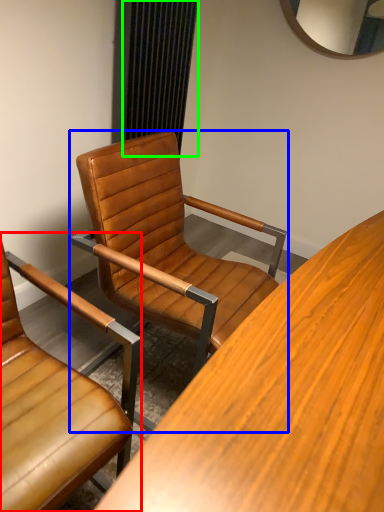
Question: Estimate the real-world distances between objects in this image. Which object is farther from chair (highlighted by a red box), chair (highlighted by a blue box) or curtain (highlighted by a green box)?

Choices:
 (A) chair
 (B) curtain

Answer: (B)